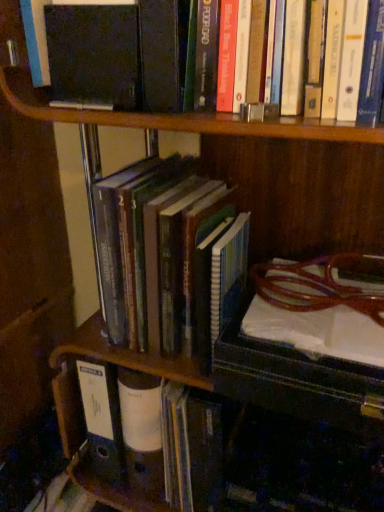
Image resolution: width=384 pixels, height=512 pixels. What do you see at coordinates (178, 446) in the screenshot?
I see `hardcover book at center, which is the second book from top to bottom` at bounding box center [178, 446].

At what (x,y) coordinates should I click in order to perform the action: click on hardcover book at center, which ranks as the first book in bottom-to-top order. Please return your answer as a coordinate pair (x, y). Image resolution: width=384 pixels, height=512 pixels. Looking at the image, I should click on (178, 446).

Locate an element on the screen. The image size is (384, 512). hardcover books at center, the second book positioned from the bottom is located at coordinates (159, 255).

The height and width of the screenshot is (512, 384). What do you see at coordinates (159, 255) in the screenshot?
I see `hardcover books at center, which is the 1th book in top-to-bottom order` at bounding box center [159, 255].

Where is `hardcover book at center, which is the second book from top to bottom`? The width and height of the screenshot is (384, 512). hardcover book at center, which is the second book from top to bottom is located at coordinates (178, 446).

Is hardcover book at center, which is the second book from top to bottom, at the left side of hardcover books at center, which is the 1th book in top-to-bottom order?

Yes.

Between hardcover book at center, which ranks as the first book in bottom-to-top order, and hardcover books at center, which is the 1th book in top-to-bottom order, which one is positioned in front?

hardcover books at center, which is the 1th book in top-to-bottom order, is more forward.

Is point (216, 410) closer or farther from the camera than point (232, 215)?

Point (216, 410) is positioned farther from the camera compared to point (232, 215).

From the image's perspective, is hardcover book at center, which ranks as the first book in bottom-to-top order, positioned above or below hardcover books at center, which is the 1th book in top-to-bottom order?

Based on their image positions, hardcover book at center, which ranks as the first book in bottom-to-top order, is located beneath hardcover books at center, which is the 1th book in top-to-bottom order.

From a real-world perspective, relative to hardcover books at center, which is the 1th book in top-to-bottom order, is hardcover book at center, which is the second book from top to bottom, vertically above or below?

hardcover book at center, which is the second book from top to bottom, is below hardcover books at center, which is the 1th book in top-to-bottom order.

Looking at their sizes, would you say hardcover book at center, which is the second book from top to bottom, is wider or thinner than hardcover books at center, the second book positioned from the bottom?

Clearly, hardcover book at center, which is the second book from top to bottom, has more width compared to hardcover books at center, the second book positioned from the bottom.

Considering the sizes of hardcover book at center, which is the second book from top to bottom, and hardcover books at center, the second book positioned from the bottom, in the image, is hardcover book at center, which is the second book from top to bottom, taller or shorter than hardcover books at center, the second book positioned from the bottom,?

hardcover book at center, which is the second book from top to bottom, is shorter than hardcover books at center, the second book positioned from the bottom.

Is hardcover book at center, which ranks as the first book in bottom-to-top order, bigger or smaller than hardcover books at center, the second book positioned from the bottom?

Considering their sizes, hardcover book at center, which ranks as the first book in bottom-to-top order, takes up less space than hardcover books at center, the second book positioned from the bottom.

Is hardcover book at center, which is the second book from top to bottom, completely or partially outside of hardcover books at center, which is the 1th book in top-to-bottom order?

Yes, hardcover book at center, which is the second book from top to bottom, is located beyond the bounds of hardcover books at center, which is the 1th book in top-to-bottom order.

Is hardcover book at center, which ranks as the first book in bottom-to-top order, with hardcover books at center, which is the 1th book in top-to-bottom order?

No, hardcover book at center, which ranks as the first book in bottom-to-top order, is not in contact with hardcover books at center, which is the 1th book in top-to-bottom order.

Could you tell me if hardcover book at center, which is the second book from top to bottom, is facing hardcover books at center, which is the 1th book in top-to-bottom order?

No, hardcover book at center, which is the second book from top to bottom, is not aimed at hardcover books at center, which is the 1th book in top-to-bottom order.

Image resolution: width=384 pixels, height=512 pixels. In order to click on book on the right of hardcover book at center, which ranks as the first book in bottom-to-top order in this screenshot , I will do `click(159, 255)`.

Which is more to the right, hardcover books at center, which is the 1th book in top-to-bottom order, or hardcover book at center, which is the second book from top to bottom?

hardcover books at center, which is the 1th book in top-to-bottom order, is more to the right.

Considering their positions, is hardcover books at center, the second book positioned from the bottom, located in front of or behind hardcover book at center, which ranks as the first book in bottom-to-top order?

In the image, hardcover books at center, the second book positioned from the bottom, appears in front of hardcover book at center, which ranks as the first book in bottom-to-top order.

Is point (188, 224) less distant than point (153, 455)?

Yes, point (188, 224) is closer to viewer.

From the image's perspective, does hardcover books at center, which is the 1th book in top-to-bottom order, appear lower than hardcover book at center, which ranks as the first book in bottom-to-top order?

Actually, hardcover books at center, which is the 1th book in top-to-bottom order, appears above hardcover book at center, which ranks as the first book in bottom-to-top order, in the image.

From a real-world perspective, is hardcover books at center, which is the 1th book in top-to-bottom order, on hardcover book at center, which is the second book from top to bottom?

Indeed, from a real-world perspective, hardcover books at center, which is the 1th book in top-to-bottom order, stands above hardcover book at center, which is the second book from top to bottom.

Does hardcover books at center, the second book positioned from the bottom, have a lesser width compared to hardcover book at center, which ranks as the first book in bottom-to-top order?

Indeed, hardcover books at center, the second book positioned from the bottom, has a lesser width compared to hardcover book at center, which ranks as the first book in bottom-to-top order.

Considering the sizes of objects hardcover books at center, the second book positioned from the bottom, and hardcover book at center, which is the second book from top to bottom, in the image provided, who is taller, hardcover books at center, the second book positioned from the bottom, or hardcover book at center, which is the second book from top to bottom,?

With more height is hardcover books at center, the second book positioned from the bottom.

Is hardcover books at center, which is the 1th book in top-to-bottom order, smaller than hardcover book at center, which ranks as the first book in bottom-to-top order?

No.

Which is correct: hardcover books at center, which is the 1th book in top-to-bottom order, is inside hardcover book at center, which ranks as the first book in bottom-to-top order, or outside of it?

hardcover books at center, which is the 1th book in top-to-bottom order, lies outside hardcover book at center, which ranks as the first book in bottom-to-top order.

Does hardcover books at center, which is the 1th book in top-to-bottom order, touch hardcover book at center, which is the second book from top to bottom?

hardcover books at center, which is the 1th book in top-to-bottom order, and hardcover book at center, which is the second book from top to bottom, are not in contact.

Could you tell me if hardcover books at center, the second book positioned from the bottom, is turned towards hardcover book at center, which is the second book from top to bottom?

No, hardcover books at center, the second book positioned from the bottom, is not oriented towards hardcover book at center, which is the second book from top to bottom.

Identify the location of book in front of the hardcover book at center, which is the second book from top to bottom. (159, 255).

What are the coordinates of `book lying on the right of hardcover book at center, which is the second book from top to bottom` in the screenshot? It's located at (159, 255).

At what (x,y) coordinates should I click in order to perform the action: click on book below the hardcover books at center, which is the 1th book in top-to-bottom order (from the image's perspective). Please return your answer as a coordinate pair (x, y). The image size is (384, 512). Looking at the image, I should click on (178, 446).